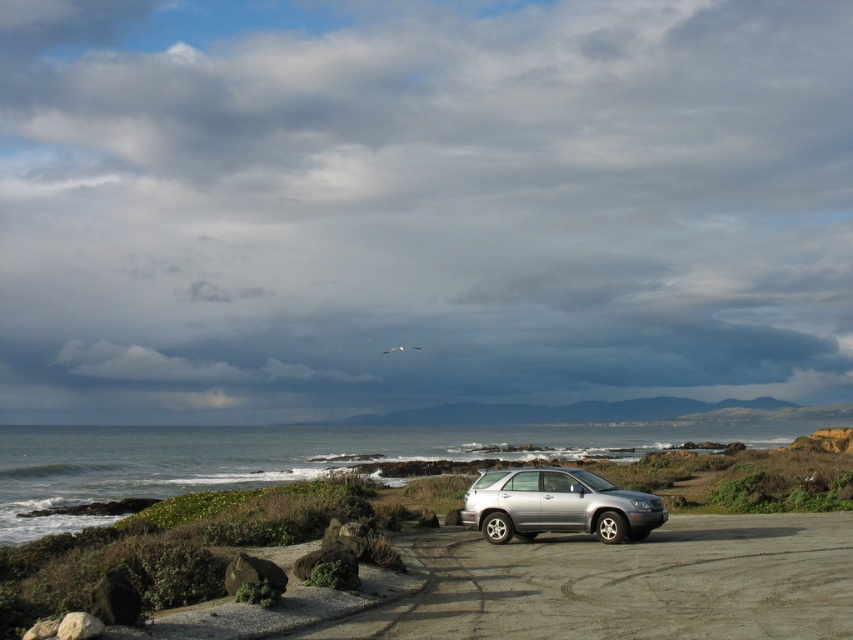
Question: Which point is closer to the camera taking this photo?

Choices:
 (A) (488, 525)
 (B) (840, 618)

Answer: (B)

Question: Does silver metallic suv at center come in front of satin silver suv at center?

Choices:
 (A) no
 (B) yes

Answer: (B)

Question: In this image, where is silver metallic suv at center located relative to satin silver suv at center?

Choices:
 (A) right
 (B) left

Answer: (B)

Question: Does silver metallic suv at center have a greater width compared to satin silver suv at center?

Choices:
 (A) no
 (B) yes

Answer: (B)

Question: Which point is closer to the camera taking this photo?

Choices:
 (A) (521, 532)
 (B) (590, 442)

Answer: (A)

Question: Which point appears farthest from the camera in this image?

Choices:
 (A) (724, 576)
 (B) (624, 504)

Answer: (B)